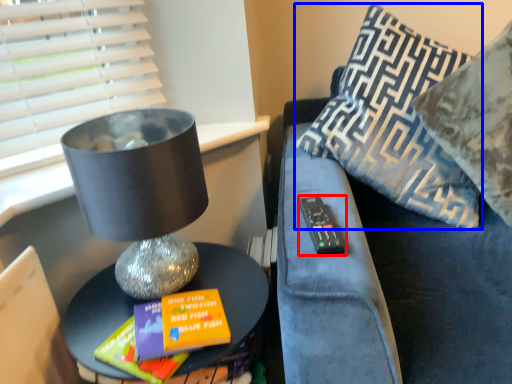
Question: Which point is further to the camera, remote (highlighted by a red box) or pillow (highlighted by a blue box)?

Choices:
 (A) remote
 (B) pillow

Answer: (B)